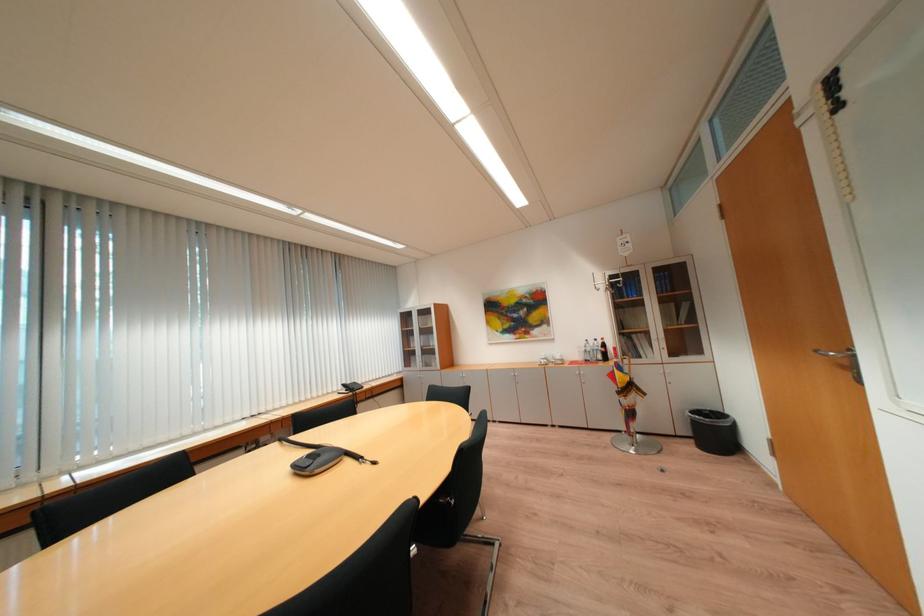
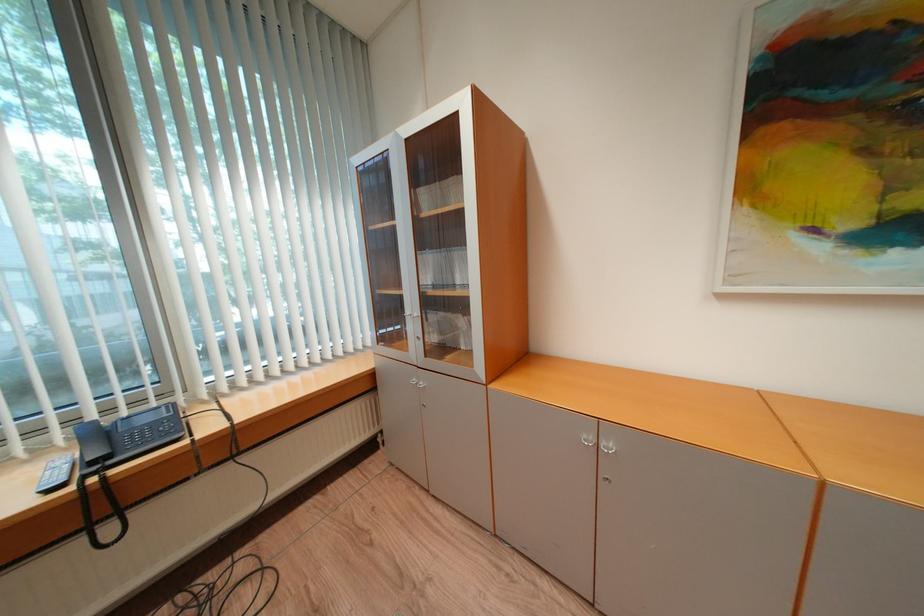
Question: What movement of the cameraman would produce the second image?

Choices:
 (A) Left
 (B) Right
 (C) Forward
 (D) Backward

Answer: (C)